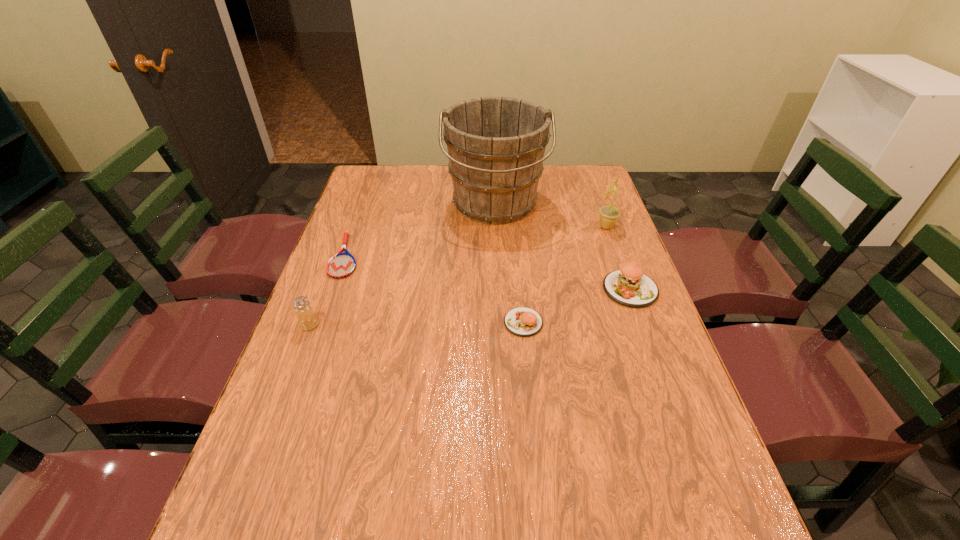
Where is `vacant space located 0.130m on the handle side of the bucket`? The width and height of the screenshot is (960, 540). vacant space located 0.130m on the handle side of the bucket is located at coordinates click(497, 262).

Locate an element on the screen. free location located 0.170m on the face of the fifth shortest object is located at coordinates (543, 226).

Identify the location of free region located on the face of the fifth shortest object. This screenshot has height=540, width=960. (497, 226).

Image resolution: width=960 pixels, height=540 pixels. In order to click on free space located 0.380m on the face of the fifth shortest object in this screenshot , I will do `click(479, 226)`.

Where is `vacant area located 0.270m on the back of the fourth shortest object`? The width and height of the screenshot is (960, 540). vacant area located 0.270m on the back of the fourth shortest object is located at coordinates (337, 253).

Where is `vacant region located 0.220m on the back of the shortest object`? vacant region located 0.220m on the back of the shortest object is located at coordinates (367, 198).

Locate an element on the screen. object that is positioned at the far edge is located at coordinates (496, 145).

Identify the location of saltshaker present at the left edge. The height and width of the screenshot is (540, 960). click(307, 320).

Where is `tennis racket present at the left edge`? Image resolution: width=960 pixels, height=540 pixels. tennis racket present at the left edge is located at coordinates (341, 265).

Identify the location of patty that is at the right edge. tap(628, 286).